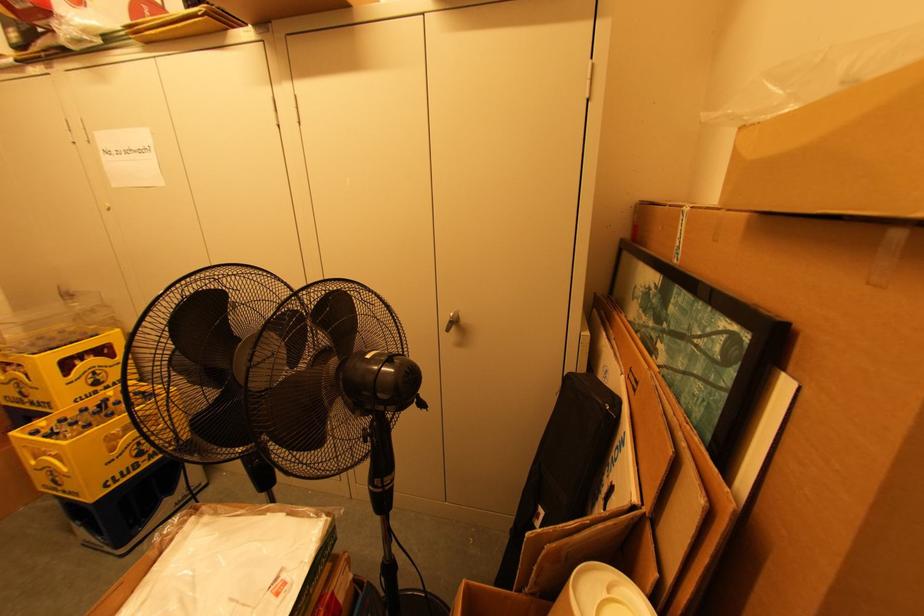
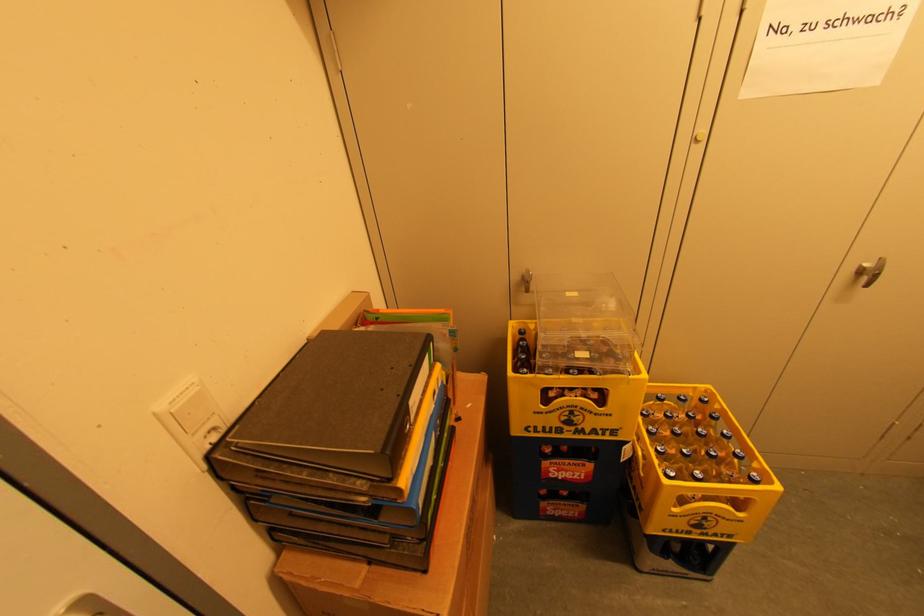
Find the pixel in the second image that matches [27,391] in the first image.

(578, 419)